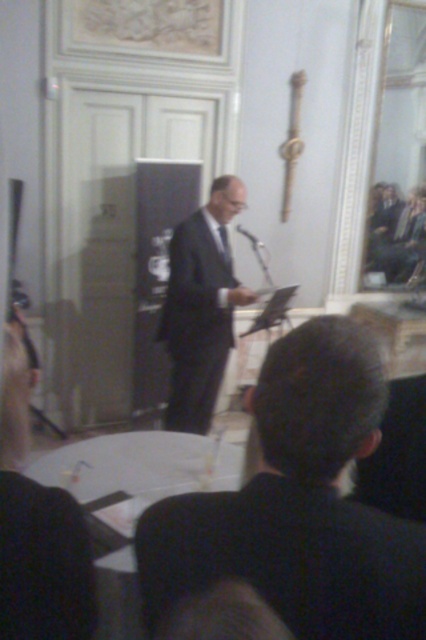
Question: Which point is farther to the camera?

Choices:
 (A) (317, 515)
 (B) (210, 237)
 (C) (253, 246)

Answer: (C)

Question: Which object is farther from the camera taking this photo?

Choices:
 (A) dark suit at center
 (B) matte black suit at center

Answer: (B)

Question: Does dark suit at center appear under matte black suit at center?

Choices:
 (A) no
 (B) yes

Answer: (B)

Question: Can you confirm if matte black suit at center is smaller than black plastic microphone at center?

Choices:
 (A) yes
 (B) no

Answer: (B)

Question: Which of the following is the farthest from the observer?

Choices:
 (A) (307, 420)
 (B) (239, 227)

Answer: (B)

Question: Does dark suit at center lie in front of matte black suit at center?

Choices:
 (A) yes
 (B) no

Answer: (A)